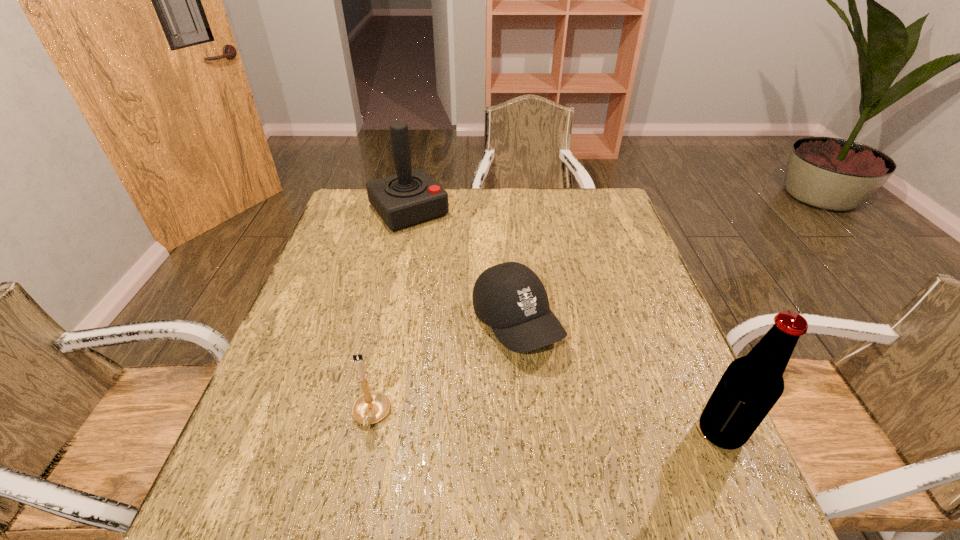
This screenshot has height=540, width=960. What are the coordinates of `free location located on the front-facing side of the third object from left to right` in the screenshot? It's located at (587, 426).

Identify the location of free point located 0.250m on the front-facing side of the third object from left to right. The width and height of the screenshot is (960, 540). (612, 461).

I want to click on object present at the far edge, so click(x=411, y=197).

Find the location of a particular element. This screenshot has height=540, width=960. candle holder that is positioned at the near edge is located at coordinates (371, 407).

You are a GUI agent. You are given a task and a screenshot of the screen. Output one action in this format:
    pyautogui.click(x=<x>, y=<y>)
    Task: Click on the beer bottle situated at the near edge
    The height and width of the screenshot is (540, 960).
    Given the screenshot: What is the action you would take?
    pyautogui.click(x=751, y=385)

Locate an element on the screen. object situated at the left edge is located at coordinates (411, 197).

You are a GUI agent. You are given a task and a screenshot of the screen. Output one action in this format:
    pyautogui.click(x=<x>, y=<y>)
    Task: Click on the object present at the right edge
    
    Given the screenshot: What is the action you would take?
    pyautogui.click(x=751, y=385)

Where is `object present at the far left corner`? The height and width of the screenshot is (540, 960). object present at the far left corner is located at coordinates (411, 197).

Locate an element on the screen. object that is at the near right corner is located at coordinates (751, 385).

This screenshot has width=960, height=540. I want to click on vacant region at the far edge of the desktop, so click(451, 211).